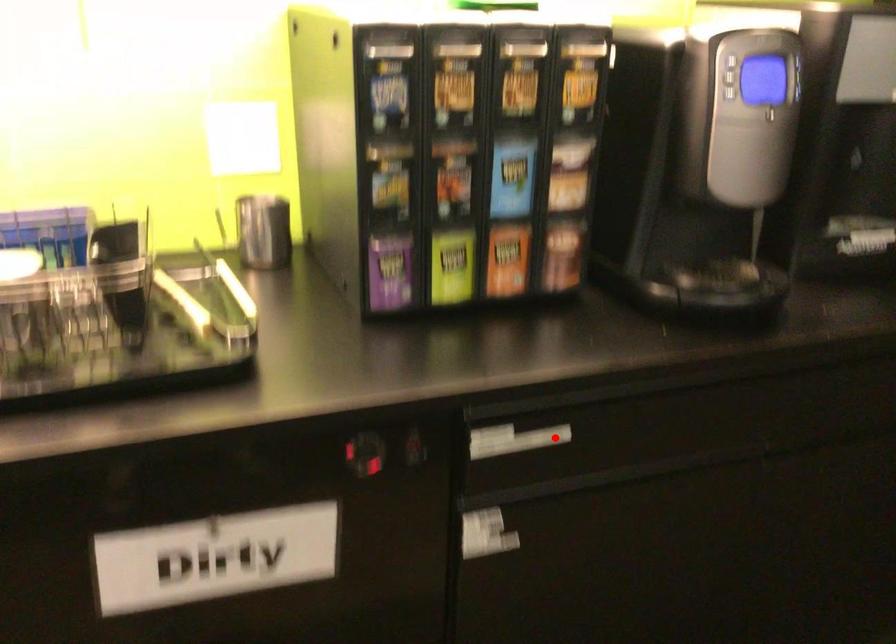
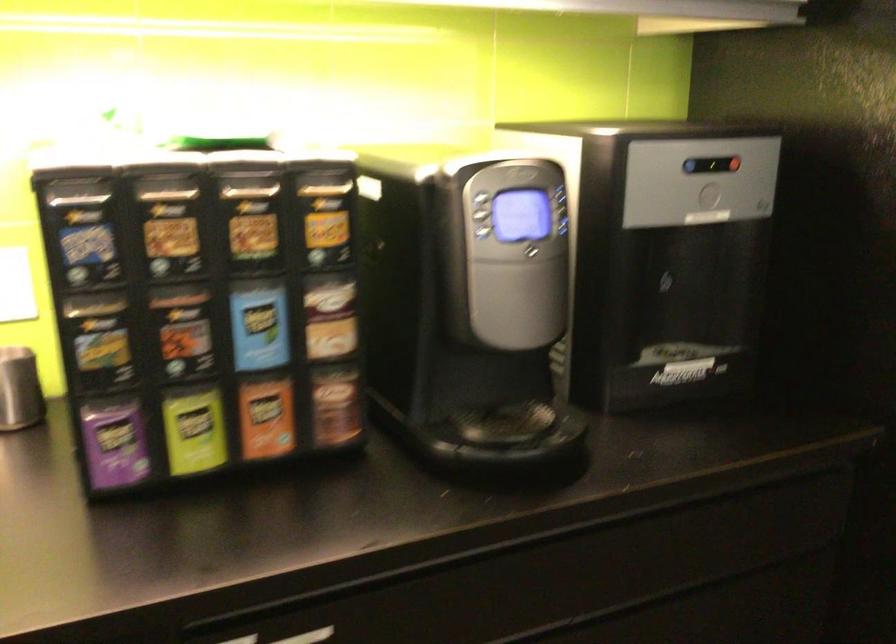
Question: I am providing you with two images of the same scene from different viewpoints. Given a red point in image1, look at the same physical point in image2. Is it:

Choices:
 (A) Closer to the viewpoint
 (B) Farther from the viewpoint

Answer: (A)